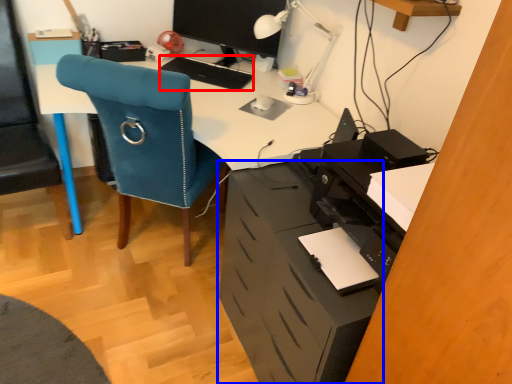
Question: Among these objects, which one is nearest to the camera, keyboard (highlighted by a red box) or file cabinet (highlighted by a blue box)?

Choices:
 (A) keyboard
 (B) file cabinet

Answer: (B)